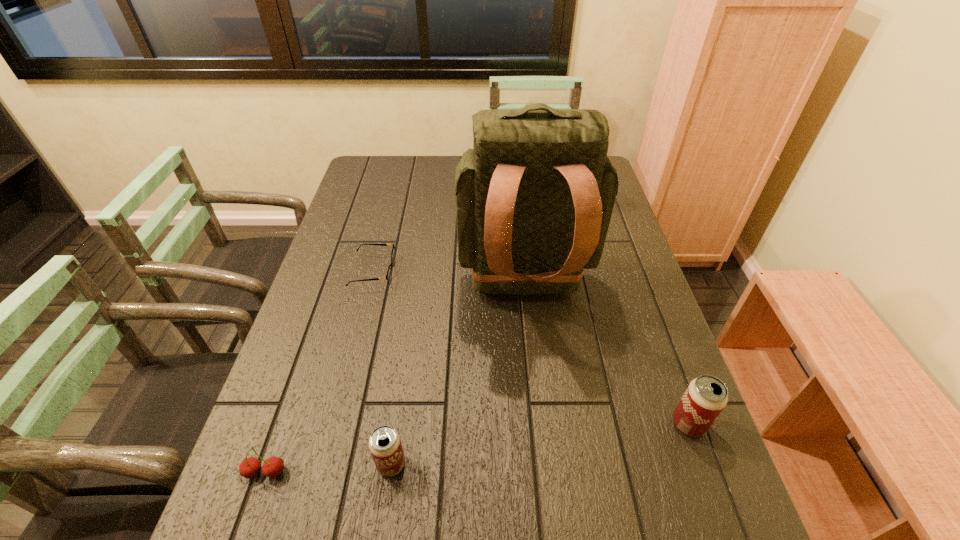
Find the location of a particular element. The width and height of the screenshot is (960, 540). free space that is in between the right beer can and the third object from left to right is located at coordinates (540, 444).

Locate an element on the screen. The image size is (960, 540). vacant space that's between the spectacles and the third object from right to left is located at coordinates (382, 368).

Where is `empty location between the backpack and the third object from left to right`? empty location between the backpack and the third object from left to right is located at coordinates (458, 378).

You are a GUI agent. You are given a task and a screenshot of the screen. Output one action in this format:
    pyautogui.click(x=<x>, y=<y>)
    Task: Click on the vacant area that lies between the leftmost object and the spectacles
    
    Given the screenshot: What is the action you would take?
    pyautogui.click(x=319, y=372)

Identify the location of object that ranks as the fourth closest to the leftmost object. This screenshot has width=960, height=540. (705, 398).

Identify which object is the third nearest to the left beer can. Please provide its 2D coordinates. Your answer should be formatted as a tuple, i.e. [(x, y)], where the tuple contains the x and y coordinates of a point satisfying the conditions above.

[(389, 273)]

At what (x,y) coordinates should I click in order to perform the action: click on vacant position in the image that satisfies the following two spatial constraints: 1. on the front-facing side of the third object from right to left; 2. on the right side of the spectacles. Please return your answer as a coordinate pair (x, y). The height and width of the screenshot is (540, 960). Looking at the image, I should click on (324, 464).

Where is `free spot that satisfies the following two spatial constraints: 1. on the back of the tallest object; 2. on the right side of the second tallest object`? This screenshot has height=540, width=960. free spot that satisfies the following two spatial constraints: 1. on the back of the tallest object; 2. on the right side of the second tallest object is located at coordinates (538, 424).

I want to click on free space that satisfies the following two spatial constraints: 1. on the back side of the shorter beer can; 2. on the right side of the right beer can, so click(397, 424).

At what (x,y) coordinates should I click in order to perform the action: click on free space that satisfies the following two spatial constraints: 1. on the front-facing side of the spectacles; 2. on the right side of the farther beer can. Please return your answer as a coordinate pair (x, y). Looking at the image, I should click on (334, 424).